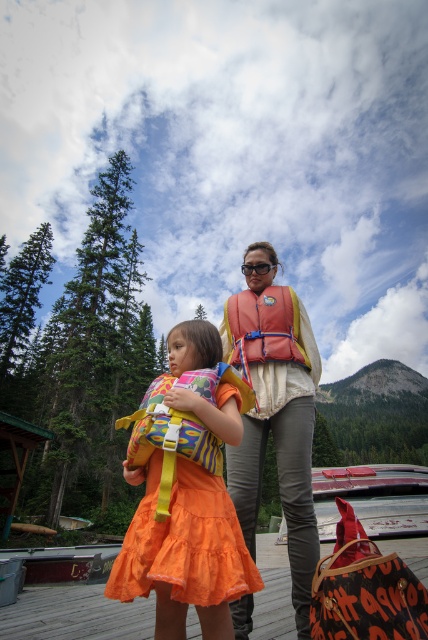
Question: Does orange life vest at center have a smaller size compared to orange fabric life jacket at center?

Choices:
 (A) yes
 (B) no

Answer: (B)

Question: Where is orange life vest at center located in relation to orange fabric life jacket at center in the image?

Choices:
 (A) right
 (B) left

Answer: (B)

Question: Which point appears closest to the camera in this image?

Choices:
 (A) (255, 358)
 (B) (338, 561)
 (C) (213, 570)

Answer: (C)

Question: Estimate the real-world distances between objects in this image. Which object is closer to the orange life vest at center?

Choices:
 (A) orange fabric life jacket at center
 (B) orange fabric dress at lower center
 (C) leather textured bag at lower right

Answer: (C)

Question: Which of the following is the closest to the observer?

Choices:
 (A) leather textured bag at lower right
 (B) orange life vest at center
 (C) orange fabric dress at lower center

Answer: (A)

Question: Is orange fabric dress at center wider than orange life vest at center?

Choices:
 (A) no
 (B) yes

Answer: (B)